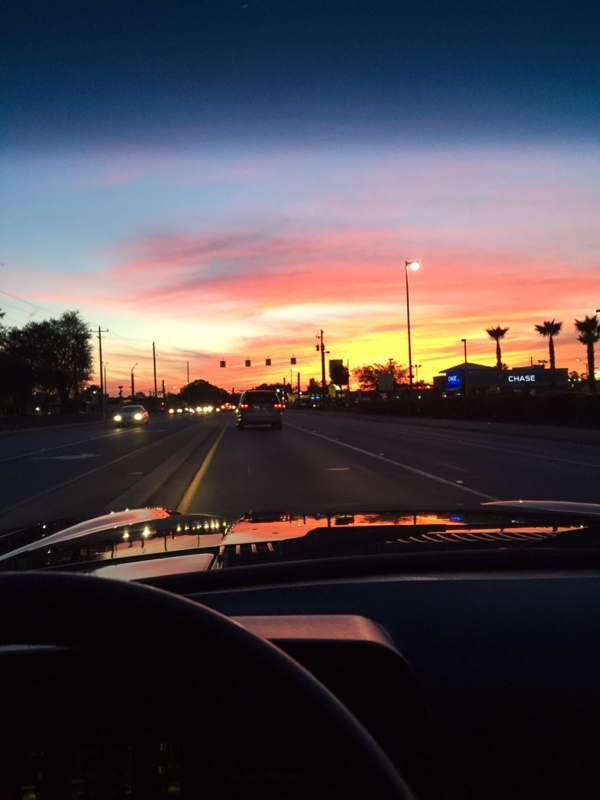
The image size is (600, 800). What are the coordinates of `lamp` in the screenshot? It's located at (415, 269).